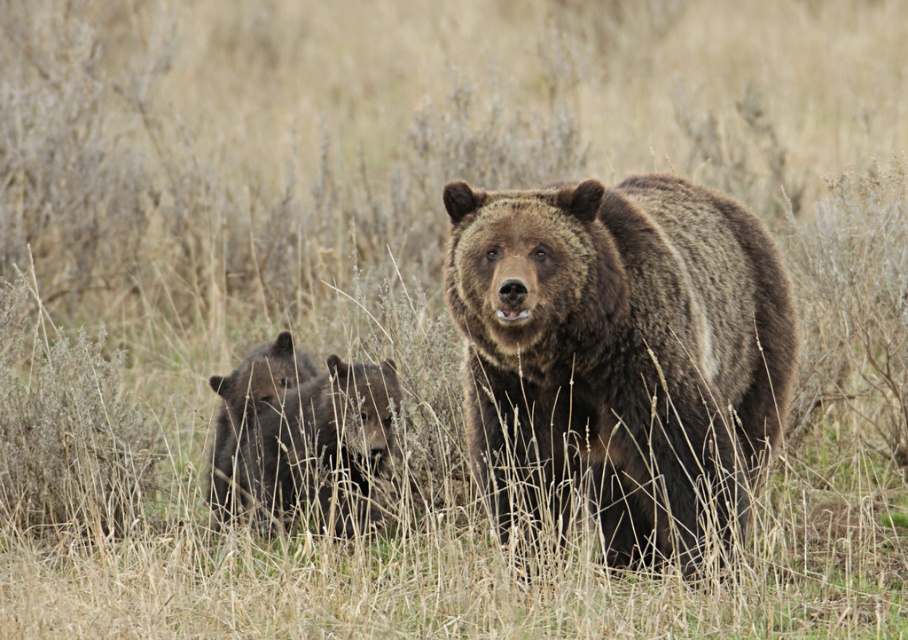
You are a photographer trying to capture the bears in the scene. Which bear, the brown furry bear at center or the shiny black bear at lower left, is closer to your camera?

The brown furry bear at center is closer to the camera because it is in front of the shiny black bear at lower left.

You are a wildlife photographer trying to capture a photo of the brown furry bear at center and the shiny black bear at lower left. Which bear should you focus on if you want to capture the wider subject in your frame?

The brown furry bear at center is wider than the shiny black bear at lower left, so you should focus on the brown furry bear at center to capture the wider subject in your frame.